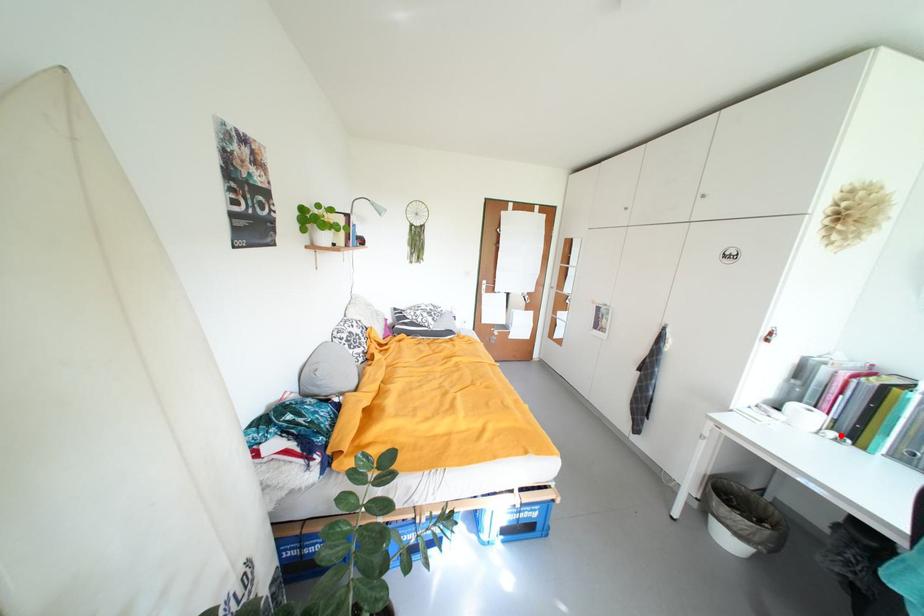
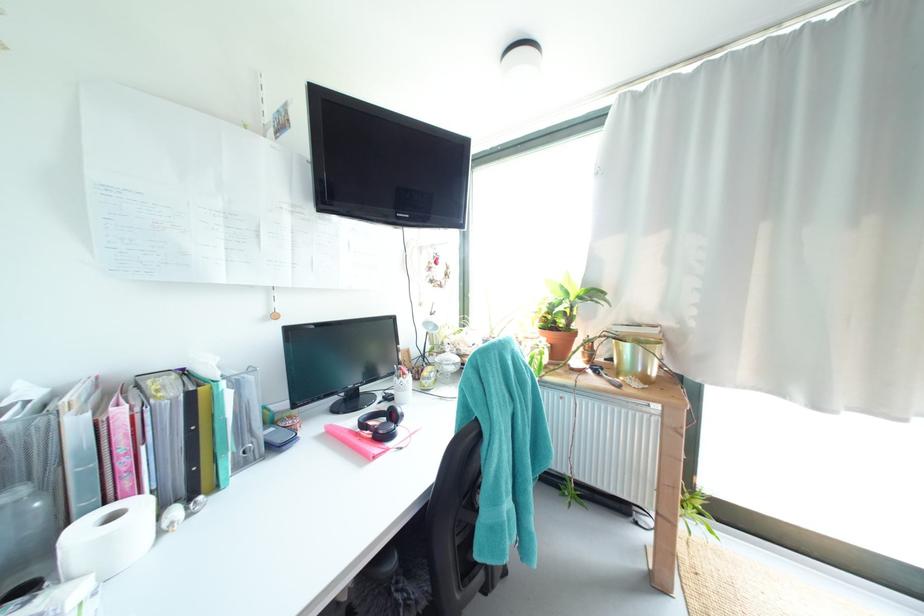
Find the pixel in the second image that matches the highlighted location in the first image.

(185, 513)